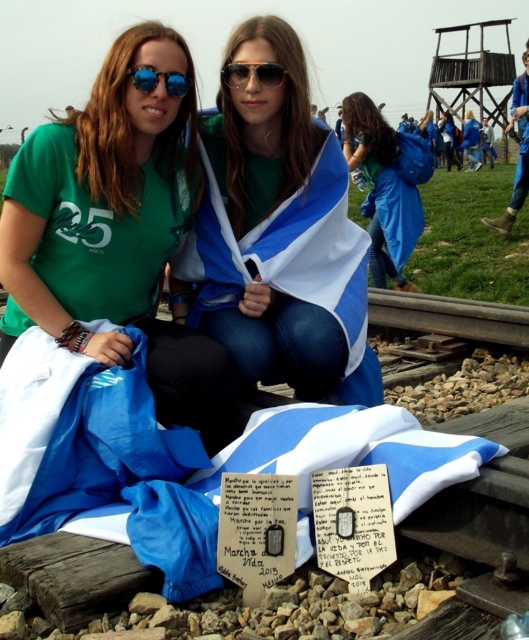
You are a photographer trying to capture the perfect shot of the shiny black sunglasses at center. The sunglasses are located at coordinates point 0.116, 0.482. If you adjust your camera to focus on the exact center of the image, will the sunglasses be in the center of your frame?

The shiny black sunglasses at center are located at point [254,74], which is not the exact center of the image. Therefore, adjusting the camera to focus on the exact center would not place the sunglasses in the center of the frame.